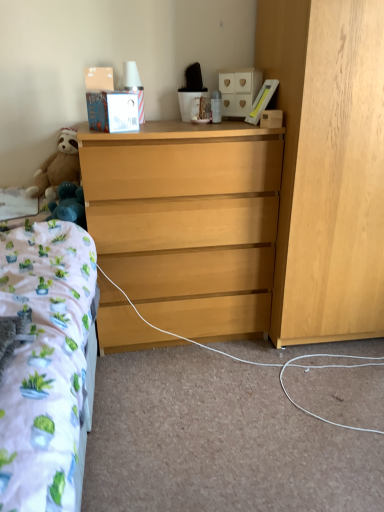
Locate an element on the screen. This screenshot has height=512, width=384. vacant space situated on the left part of wooden box at upper right is located at coordinates (233, 127).